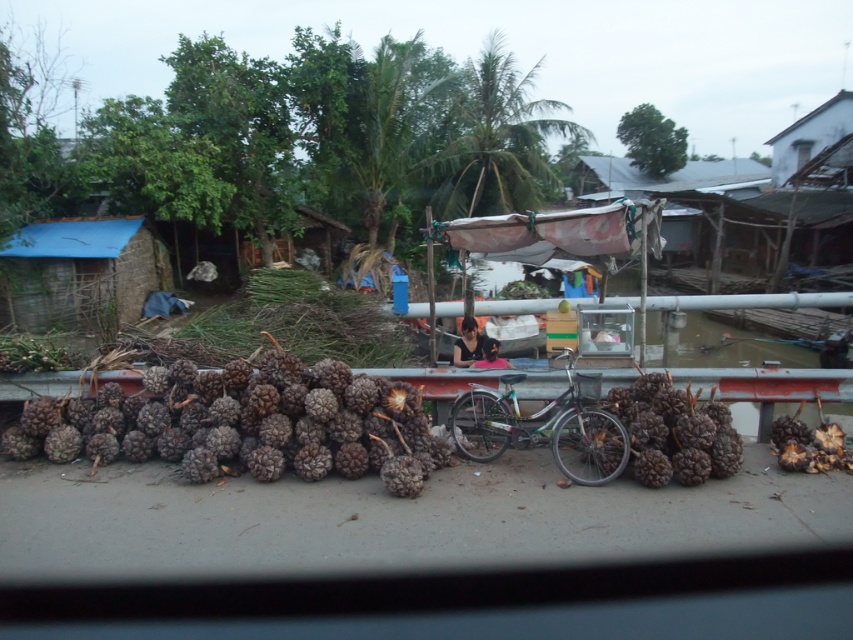
You are a delivery person who needs to place a package between the metallic silver bicycle at center and the brown rough pine cone at right. The package requires a space of 1.5 meters. Is there enough space between them?

The distance between the metallic silver bicycle at center and the brown rough pine cone at right is 1.74 meters, which is sufficient to accommodate the package requiring 1.5 meters of space.

You are a delivery person trying to navigate through the scene. You need to place a package between the blue tarp at left and the brown rough pine cone at right. Is there enough space between them for the package?

The blue tarp at left is to the left of brown rough pine cone at right, so there is space between them. The package can be placed there.

You are a delivery person needing to place a box between the brown rough pinecones at center and the brown rough pine cone at right. Which pinecone should you place the box closer to to ensure it fits within the space?

The brown rough pine cone at right is narrower, so placing the box closer to it would ensure it fits within the space.